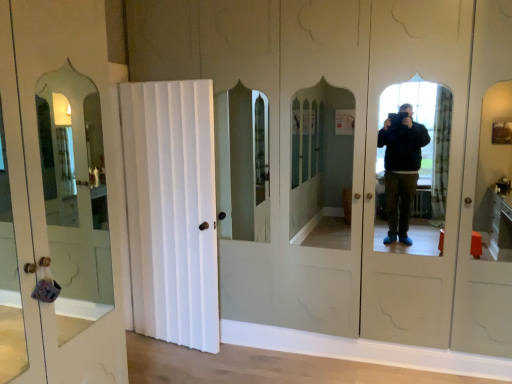
What do you see at coordinates (172, 210) in the screenshot? I see `white wood door at center, positioned as the 1th door in right-to-left order` at bounding box center [172, 210].

Identify the location of white wood door at center, positioned as the 1th door in right-to-left order. This screenshot has width=512, height=384. (172, 210).

What is the approximate height of white wood door at center, which is the second door from left to right?

It is 1.98 meters.

Where is `white wooden door at left, the 1th door from the left`? white wooden door at left, the 1th door from the left is located at coordinates (59, 194).

Describe the element at coordinates (59, 194) in the screenshot. I see `white wooden door at left, positioned as the 2th door in right-to-left order` at that location.

What is the approximate height of white wooden door at left, the 1th door from the left?

white wooden door at left, the 1th door from the left, is 6.94 feet tall.

Locate an element on the screen. white wood door at center, which is the second door from left to right is located at coordinates point(172,210).

Considering the positions of objects white wood door at center, which is the second door from left to right, and white wooden door at left, the 1th door from the left, in the image provided, who is more to the left, white wood door at center, which is the second door from left to right, or white wooden door at left, the 1th door from the left,?

From the viewer's perspective, white wooden door at left, the 1th door from the left, appears more on the left side.

Who is more distant, white wood door at center, which is the second door from left to right, or white wooden door at left, the 1th door from the left?

Positioned behind is white wood door at center, which is the second door from left to right.

Is point (206, 275) positioned in front of point (34, 184)?

No, it is not.

From the image's perspective, which object appears higher, white wood door at center, which is the second door from left to right, or white wooden door at left, the 1th door from the left?

white wooden door at left, the 1th door from the left, appears higher in the image.

From a real-world perspective, is white wood door at center, which is the second door from left to right, physically below white wooden door at left, positioned as the 2th door in right-to-left order?

Correct, in the physical world, white wood door at center, which is the second door from left to right, is lower than white wooden door at left, positioned as the 2th door in right-to-left order.

Can you confirm if white wood door at center, positioned as the 1th door in right-to-left order, is thinner than white wooden door at left, positioned as the 2th door in right-to-left order?

In fact, white wood door at center, positioned as the 1th door in right-to-left order, might be wider than white wooden door at left, positioned as the 2th door in right-to-left order.

From their relative heights in the image, would you say white wood door at center, which is the second door from left to right, is taller or shorter than white wooden door at left, positioned as the 2th door in right-to-left order?

Clearly, white wood door at center, which is the second door from left to right, is shorter compared to white wooden door at left, positioned as the 2th door in right-to-left order.

Does white wood door at center, which is the second door from left to right, have a smaller size compared to white wooden door at left, the 1th door from the left?

Indeed, white wood door at center, which is the second door from left to right, has a smaller size compared to white wooden door at left, the 1th door from the left.

Is white wood door at center, which is the second door from left to right, completely or partially outside of white wooden door at left, the 1th door from the left?

Yes.

Consider the image. Is white wood door at center, which is the second door from left to right, directly adjacent to white wooden door at left, the 1th door from the left?

white wood door at center, which is the second door from left to right, and white wooden door at left, the 1th door from the left, are not in contact.

Could you tell me if white wood door at center, positioned as the 1th door in right-to-left order, is turned towards white wooden door at left, the 1th door from the left?

Yes, white wood door at center, positioned as the 1th door in right-to-left order, is facing white wooden door at left, the 1th door from the left.

What's the angular difference between white wood door at center, which is the second door from left to right, and white wooden door at left, positioned as the 2th door in right-to-left order,'s facing directions?

The angular difference between white wood door at center, which is the second door from left to right, and white wooden door at left, positioned as the 2th door in right-to-left order, is 98.8 degrees.

Locate an element on the screen. The image size is (512, 384). door on the left of white wood door at center, which is the second door from left to right is located at coordinates (59, 194).

Which object is positioned more to the left, white wooden door at left, the 1th door from the left, or white wood door at center, which is the second door from left to right?

white wooden door at left, the 1th door from the left.

Does white wooden door at left, positioned as the 2th door in right-to-left order, lie behind white wood door at center, positioned as the 1th door in right-to-left order?

No, it is in front of white wood door at center, positioned as the 1th door in right-to-left order.

Which is behind, point (42, 145) or point (214, 229)?

Positioned behind is point (214, 229).

From the image's perspective, which is below, white wooden door at left, the 1th door from the left, or white wood door at center, positioned as the 1th door in right-to-left order?

white wood door at center, positioned as the 1th door in right-to-left order.

From a real-world perspective, is white wooden door at left, the 1th door from the left, physically located above or below white wood door at center, which is the second door from left to right?

white wooden door at left, the 1th door from the left, is above white wood door at center, which is the second door from left to right.

Between white wooden door at left, positioned as the 2th door in right-to-left order, and white wood door at center, positioned as the 1th door in right-to-left order, which one has smaller width?

white wooden door at left, positioned as the 2th door in right-to-left order.

From their relative heights in the image, would you say white wooden door at left, positioned as the 2th door in right-to-left order, is taller or shorter than white wood door at center, which is the second door from left to right?

Clearly, white wooden door at left, positioned as the 2th door in right-to-left order, is taller compared to white wood door at center, which is the second door from left to right.

Between white wooden door at left, positioned as the 2th door in right-to-left order, and white wood door at center, which is the second door from left to right, which one has larger size?

Bigger between the two is white wooden door at left, positioned as the 2th door in right-to-left order.

Is white wooden door at left, the 1th door from the left, spatially inside white wood door at center, positioned as the 1th door in right-to-left order, or outside of it?

white wooden door at left, the 1th door from the left, is not inside white wood door at center, positioned as the 1th door in right-to-left order, it's outside.

Consider the image. Is white wooden door at left, the 1th door from the left, positioned far away from white wood door at center, which is the second door from left to right?

Yes, white wooden door at left, the 1th door from the left, is far from white wood door at center, which is the second door from left to right.

Could you tell me if white wooden door at left, the 1th door from the left, is turned towards white wood door at center, positioned as the 1th door in right-to-left order?

Yes, white wooden door at left, the 1th door from the left, is oriented towards white wood door at center, positioned as the 1th door in right-to-left order.

How many degrees apart are the facing directions of white wooden door at left, the 1th door from the left, and white wood door at center, which is the second door from left to right?

98.8 degrees.

This screenshot has height=384, width=512. I want to click on door to the left of white wood door at center, positioned as the 1th door in right-to-left order, so click(x=59, y=194).

Where is `door below the white wooden door at left, positioned as the 2th door in right-to-left order (from a real-world perspective)`? door below the white wooden door at left, positioned as the 2th door in right-to-left order (from a real-world perspective) is located at coordinates (172, 210).

I want to click on door behind the white wooden door at left, positioned as the 2th door in right-to-left order, so [172, 210].